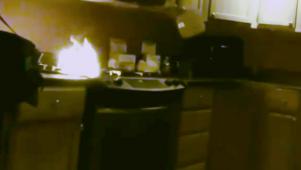
The image size is (301, 170). What are the coordinates of `white cabinets` in the screenshot? It's located at (244, 7), (276, 14).